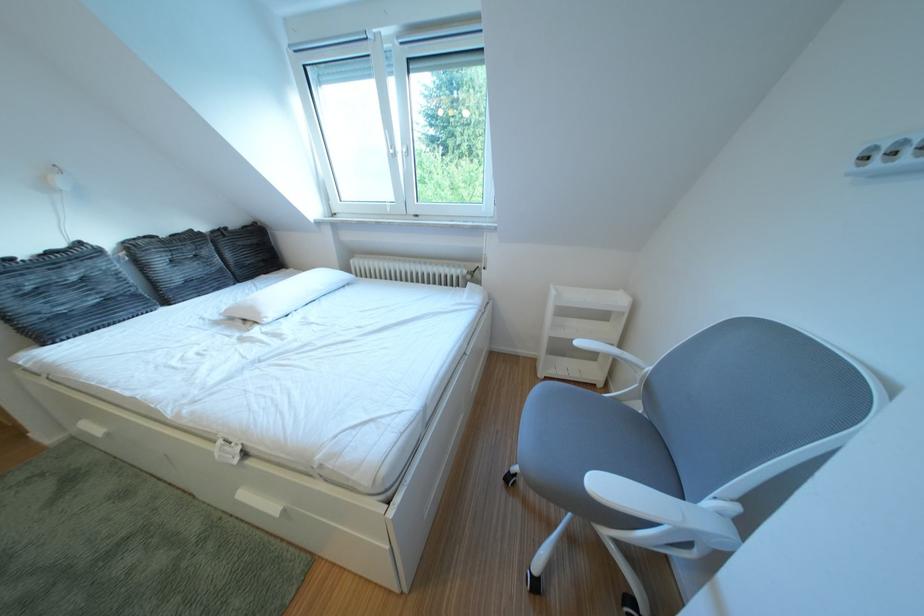
What do you see at coordinates (390, 146) in the screenshot? Image resolution: width=924 pixels, height=616 pixels. I see `the white window handle` at bounding box center [390, 146].